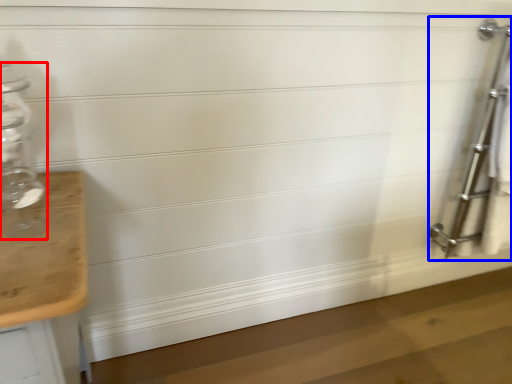
Question: Among these objects, which one is farthest to the camera, glass bottle (highlighted by a red box) or ladder (highlighted by a blue box)?

Choices:
 (A) glass bottle
 (B) ladder

Answer: (B)